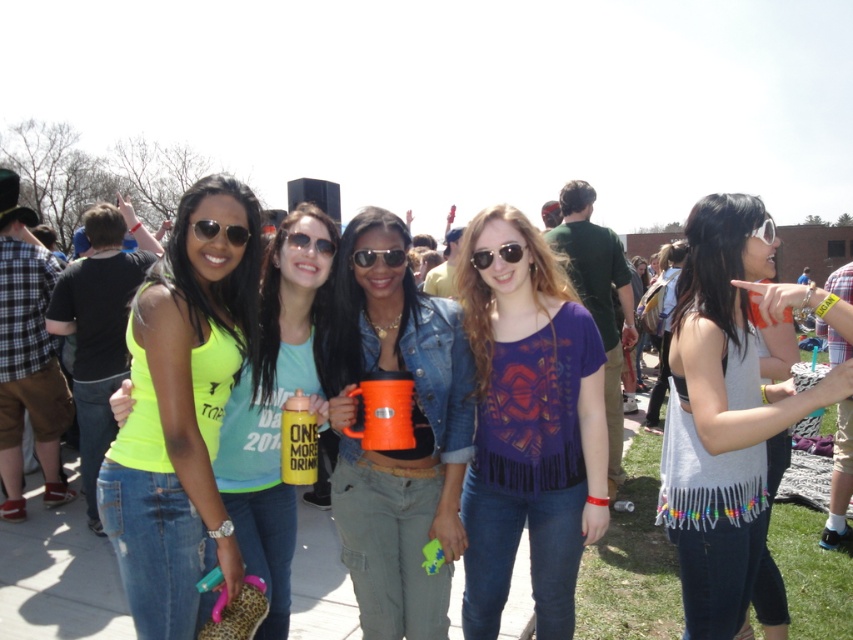
Is matte plastic sunglasses at center smaller than white plastic goggles at upper right?

Correct, matte plastic sunglasses at center occupies less space than white plastic goggles at upper right.

Does matte plastic sunglasses at center appear on the left side of white plastic goggles at upper right?

Correct, you'll find matte plastic sunglasses at center to the left of white plastic goggles at upper right.

Locate an element on the screen. The height and width of the screenshot is (640, 853). matte plastic sunglasses at center is located at coordinates (309, 243).

Does purple fringed shirt at center appear on the left side of black plastic sunglasses at center?

Incorrect, purple fringed shirt at center is not on the left side of black plastic sunglasses at center.

Does purple fringed shirt at center appear under black plastic sunglasses at center?

Yes, purple fringed shirt at center is below black plastic sunglasses at center.

Is point (566, 384) closer to camera compared to point (399, 257)?

No, (566, 384) is behind (399, 257).

I want to click on purple fringed shirt at center, so 529,426.

Between white fringe tank top at center and neon yellow tank top at center, which one appears on the left side from the viewer's perspective?

Positioned to the left is neon yellow tank top at center.

How much distance is there between white fringe tank top at center and neon yellow tank top at center?

A distance of 1.40 meters exists between white fringe tank top at center and neon yellow tank top at center.

Is point (749, 380) behind point (299, 278)?

No, (749, 380) is closer to viewer.

This screenshot has width=853, height=640. Identify the location of white fringe tank top at center. (723, 416).